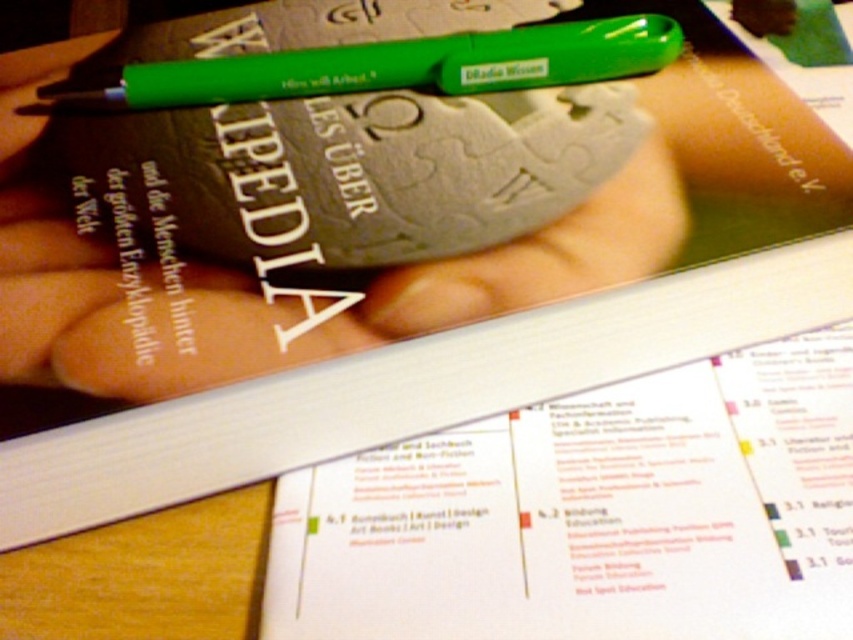
Question: Is green matte pen at upper center behind green plastic pen at upper center?

Choices:
 (A) no
 (B) yes

Answer: (A)

Question: Can you confirm if green matte pen at upper center is bigger than green plastic pen at upper center?

Choices:
 (A) yes
 (B) no

Answer: (A)

Question: Which of the following is the closest to the observer?

Choices:
 (A) green plastic pen at upper center
 (B) green matte pen at upper center

Answer: (B)

Question: Does green matte pen at upper center appear under green plastic pen at upper center?

Choices:
 (A) yes
 (B) no

Answer: (A)

Question: Which point is farther from the camera taking this photo?

Choices:
 (A) (346, 45)
 (B) (383, 305)

Answer: (A)